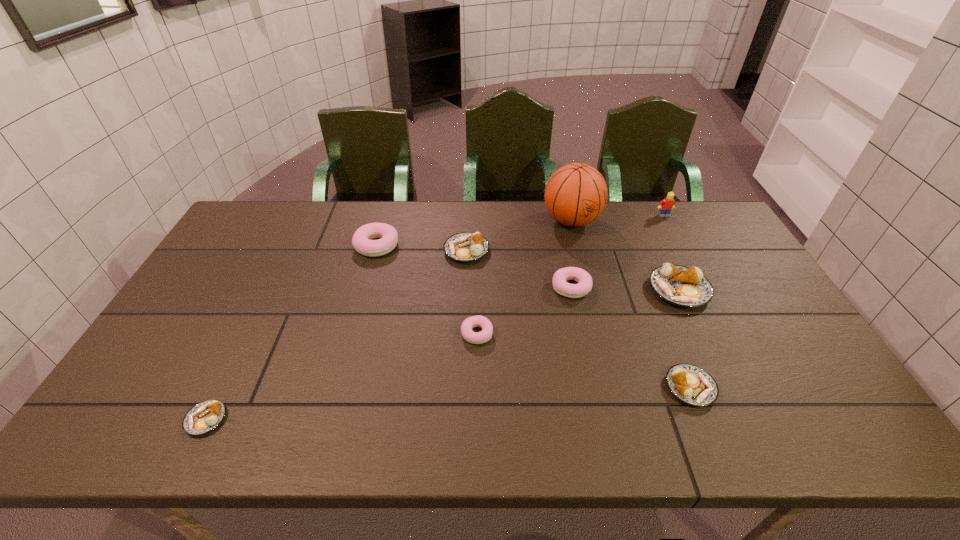
Image resolution: width=960 pixels, height=540 pixels. I want to click on brown pastry that is the second nearest to the leftmost object, so click(691, 384).

Identify which pink pastry is located as the second nearest to the nearest pink pastry. Please provide its 2D coordinates. Your answer should be formatted as a tuple, i.e. [(x, y)], where the tuple contains the x and y coordinates of a point satisfying the conditions above.

[(361, 241)]

This screenshot has width=960, height=540. Find the location of `the second closest pink pastry to the smallest brown pastry`. the second closest pink pastry to the smallest brown pastry is located at coordinates (485, 335).